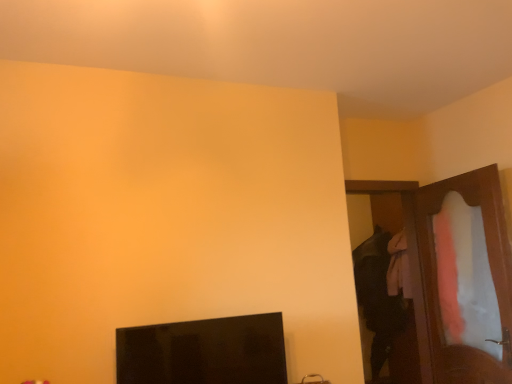
Question: From the image's perspective, would you say wooden dresser at right is positioned over wooden door at right?

Choices:
 (A) yes
 (B) no

Answer: (A)

Question: Does wooden dresser at right have a lesser height compared to wooden door at right?

Choices:
 (A) yes
 (B) no

Answer: (A)

Question: From the image's perspective, is wooden dresser at right beneath wooden door at right?

Choices:
 (A) no
 (B) yes

Answer: (A)

Question: Are wooden dresser at right and wooden door at right beside each other?

Choices:
 (A) no
 (B) yes

Answer: (A)

Question: From a real-world perspective, is wooden dresser at right physically below wooden door at right?

Choices:
 (A) no
 (B) yes

Answer: (B)

Question: Considering the positions of point (431, 251) and point (411, 256), is point (431, 251) closer or farther from the camera than point (411, 256)?

Choices:
 (A) farther
 (B) closer

Answer: (B)

Question: Is wooden dresser at right inside the boundaries of wooden door at right, or outside?

Choices:
 (A) inside
 (B) outside

Answer: (B)

Question: From a real-world perspective, is wooden dresser at right positioned above or below wooden door at right?

Choices:
 (A) above
 (B) below

Answer: (B)

Question: In the image, is wooden dresser at right on the left side or the right side of wooden door at right?

Choices:
 (A) right
 (B) left

Answer: (A)

Question: Relative to wooden dresser at right, is black glossy monitor at lower left in front or behind?

Choices:
 (A) behind
 (B) front

Answer: (B)

Question: Considering the positions of black glossy monitor at lower left and wooden dresser at right in the image, is black glossy monitor at lower left bigger or smaller than wooden dresser at right?

Choices:
 (A) small
 (B) big

Answer: (A)

Question: From a real-world perspective, is black glossy monitor at lower left physically located above or below wooden dresser at right?

Choices:
 (A) below
 (B) above

Answer: (A)

Question: From the image's perspective, is black glossy monitor at lower left located above or below wooden dresser at right?

Choices:
 (A) below
 (B) above

Answer: (A)

Question: Considering the positions of point (118, 360) and point (352, 193), is point (118, 360) closer or farther from the camera than point (352, 193)?

Choices:
 (A) closer
 (B) farther

Answer: (A)

Question: Looking at the image, does black glossy monitor at lower left seem bigger or smaller compared to wooden door at right?

Choices:
 (A) big
 (B) small

Answer: (B)